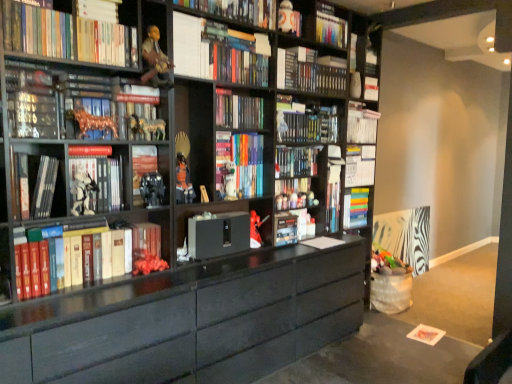
This screenshot has width=512, height=384. Find the location of `free spot above metallic glass at left, which is the 8th book in top-to-bottom order (from a real-world perspective)`. free spot above metallic glass at left, which is the 8th book in top-to-bottom order (from a real-world perspective) is located at coordinates (28, 92).